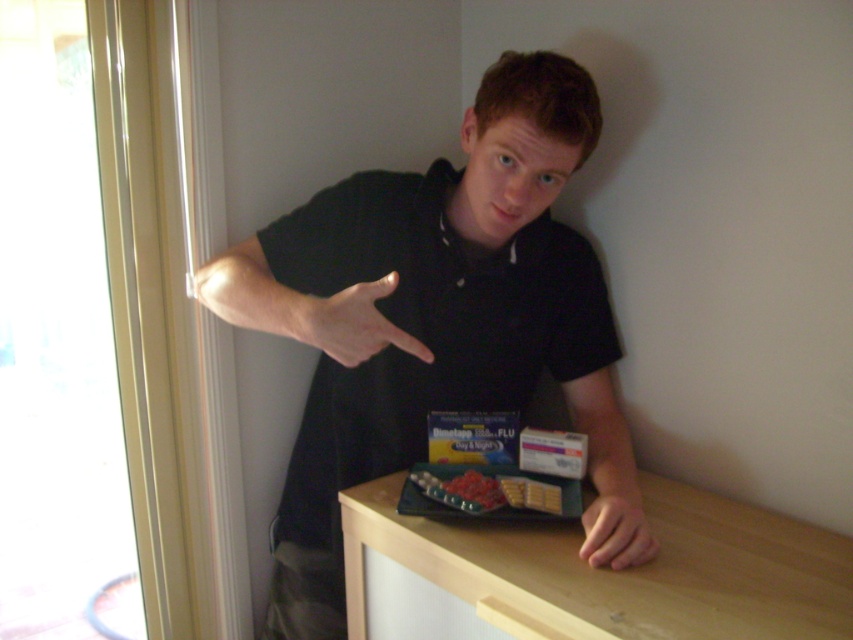
Looking at this image, between smooth skin hand at lower right and matte black hand at center, which one appears on the left side from the viewer's perspective?

matte black hand at center is more to the left.

Is smooth skin hand at lower right taller than matte black hand at center?

Indeed, smooth skin hand at lower right has a greater height compared to matte black hand at center.

At what (x,y) coordinates should I click in order to perform the action: click on smooth skin hand at lower right. Please return your answer as a coordinate pair (x, y). This screenshot has width=853, height=640. Looking at the image, I should click on (616, 522).

Measure the distance from black matte shirt at center to smooth plastic tray at center.

black matte shirt at center is 10.84 inches away from smooth plastic tray at center.

Does black matte shirt at center have a lesser width compared to smooth plastic tray at center?

No, black matte shirt at center is not thinner than smooth plastic tray at center.

Which is behind, point (378, 369) or point (514, 497)?

The point (378, 369) is behind.

Where is `black matte shirt at center`? This screenshot has height=640, width=853. black matte shirt at center is located at coordinates (430, 308).

Can you confirm if black matte shirt at center is positioned to the left of matte black hand at center?

Incorrect, black matte shirt at center is not on the left side of matte black hand at center.

Who is more forward, (361, 438) or (341, 292)?

Positioned in front is point (341, 292).

Find the location of a particular element. black matte shirt at center is located at coordinates (430, 308).